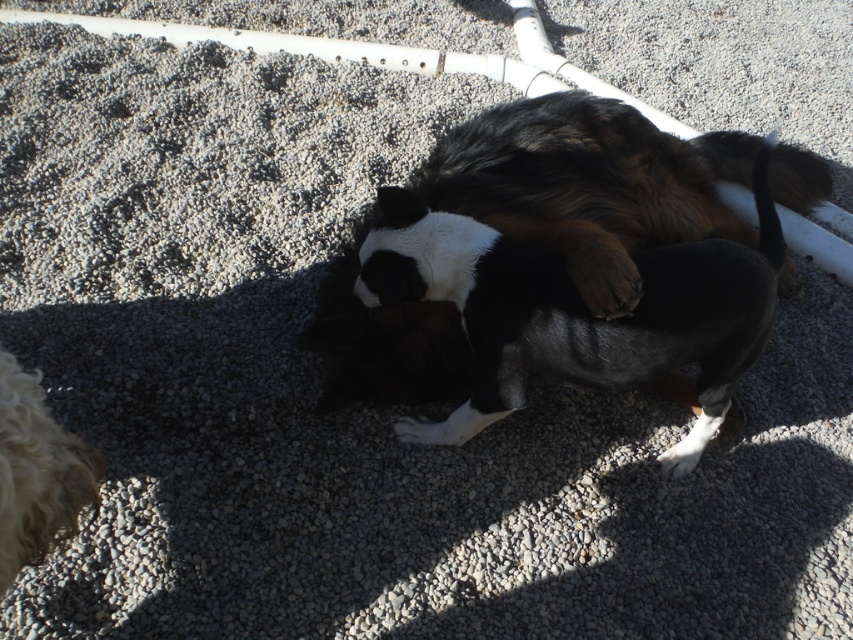
Does brown furry paw at center have a smaller size compared to white fur paw at lower center?

No, brown furry paw at center is not smaller than white fur paw at lower center.

Can you confirm if brown furry paw at center is thinner than white fur paw at lower center?

No, brown furry paw at center is not thinner than white fur paw at lower center.

The height and width of the screenshot is (640, 853). Identify the location of brown furry paw at center. (601, 269).

Is the position of brown fur dog at center more distant than that of brown furry paw at center?

Yes, it is behind brown furry paw at center.

Does brown fur dog at center appear on the right side of brown furry paw at center?

Correct, you'll find brown fur dog at center to the right of brown furry paw at center.

The height and width of the screenshot is (640, 853). Find the location of `brown fur dog at center`. brown fur dog at center is located at coordinates (589, 184).

Is point (761, 323) closer to viewer compared to point (83, 470)?

No, it is not.

Can you confirm if black and white fur at center is positioned to the right of curly golden fur at lower left?

Indeed, black and white fur at center is positioned on the right side of curly golden fur at lower left.

This screenshot has width=853, height=640. Describe the element at coordinates (579, 305) in the screenshot. I see `black and white fur at center` at that location.

Identify the location of black and white fur at center. tap(579, 305).